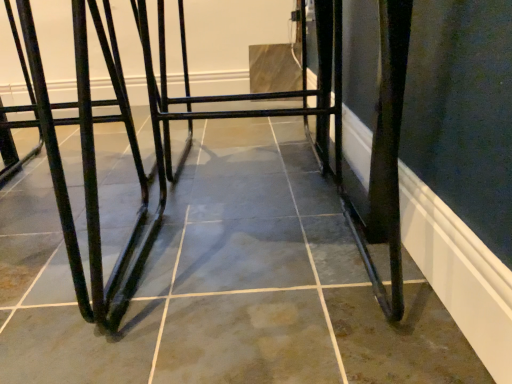
Locate an element on the screen. Image resolution: width=512 pixels, height=384 pixels. vacant space underneath black metal table at center (from a real-world perspective) is located at coordinates (248, 297).